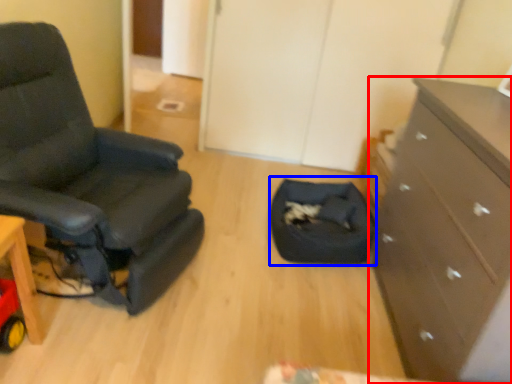
Question: Which of the following is the closest to the observer, chest of drawers (highlighted by a red box) or footrest (highlighted by a blue box)?

Choices:
 (A) chest of drawers
 (B) footrest

Answer: (A)